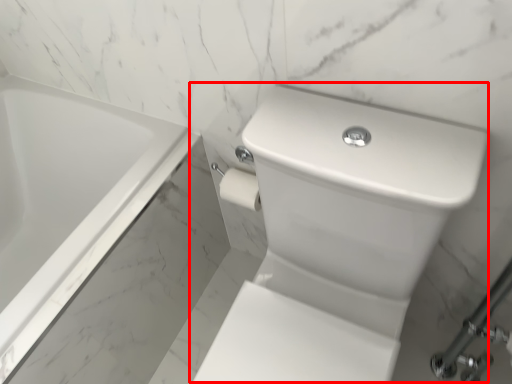
Question: In this image, where is sink (annotated by the red box) located relative to bathtub?

Choices:
 (A) right
 (B) left

Answer: (A)